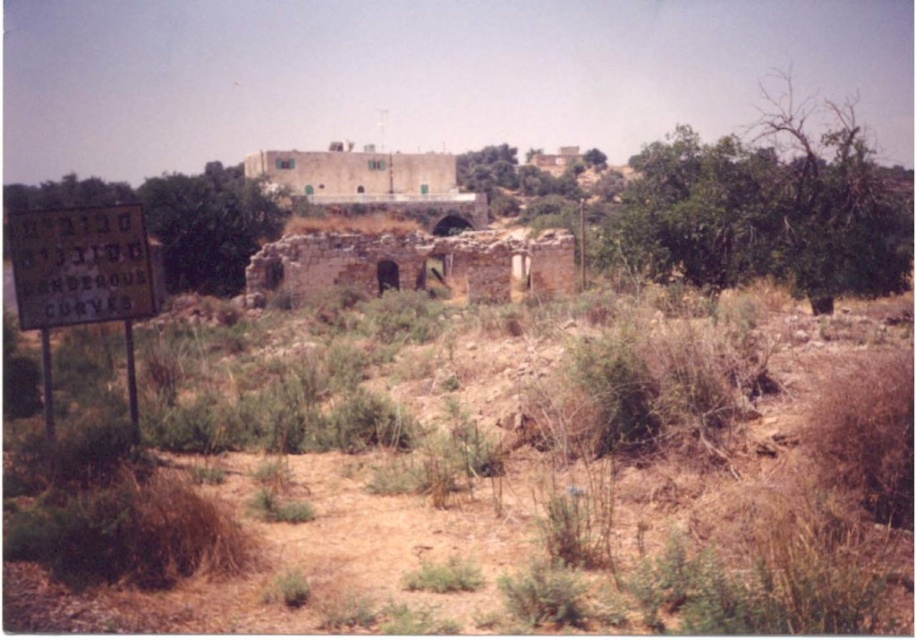
Question: Which of the following is the farthest from the observer?

Choices:
 (A) yellow paper sign at left
 (B) brown dry grass at lower center

Answer: (A)

Question: Is brown dry grass at lower center smaller than yellow paper sign at left?

Choices:
 (A) no
 (B) yes

Answer: (A)

Question: Which of the following is the closest to the observer?

Choices:
 (A) (12, 253)
 (B) (240, 365)

Answer: (A)

Question: Which object is farther from the camera taking this photo?

Choices:
 (A) brown dry grass at lower center
 (B) yellow paper sign at left

Answer: (B)

Question: Considering the relative positions of brown dry grass at lower center and yellow paper sign at left in the image provided, where is brown dry grass at lower center located with respect to yellow paper sign at left?

Choices:
 (A) above
 (B) below

Answer: (B)

Question: Can you confirm if brown dry grass at lower center is positioned above yellow paper sign at left?

Choices:
 (A) yes
 (B) no

Answer: (B)